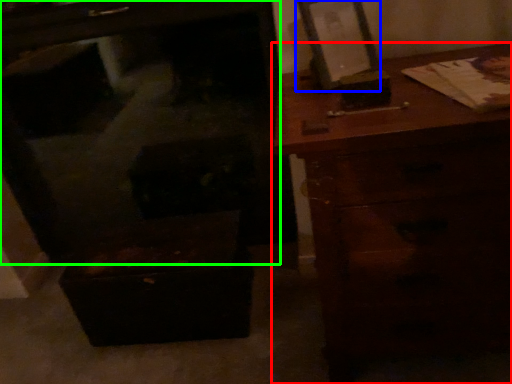
Question: Which object is positioned closest to chest of drawers (highlighted by a red box)? Select from picture frame (highlighted by a blue box) and furniture (highlighted by a green box).

Choices:
 (A) picture frame
 (B) furniture

Answer: (A)